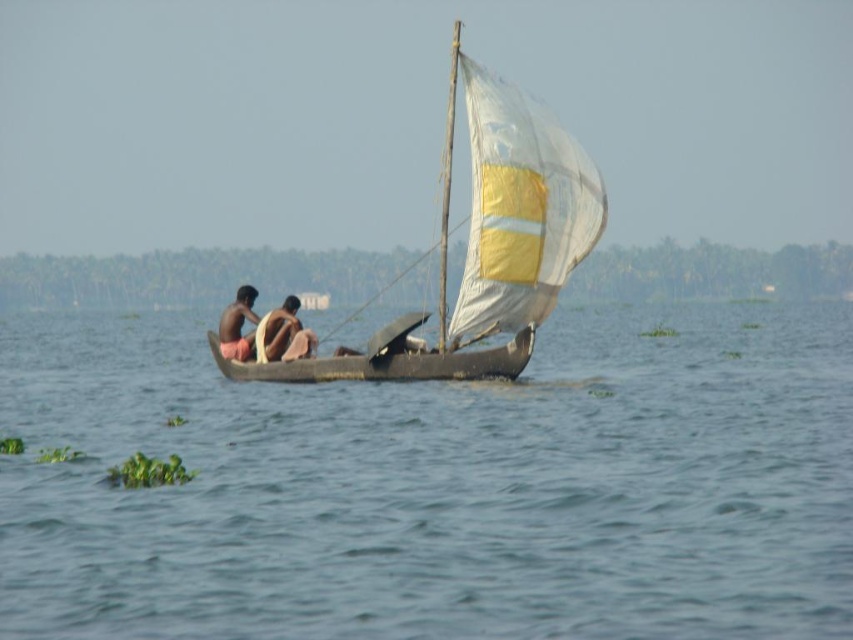
Question: Can you confirm if blue water at center is wider than white fabric sailboat at center?

Choices:
 (A) no
 (B) yes

Answer: (B)

Question: Is brown skin person at center further to the viewer compared to brown skin person at left?

Choices:
 (A) yes
 (B) no

Answer: (B)

Question: Which object appears farthest from the camera in this image?

Choices:
 (A) white fabric sailboat at center
 (B) brown skin person at left
 (C) blue water at center

Answer: (B)

Question: Which object is the farthest from the white fabric sailboat at center?

Choices:
 (A) brown skin person at center
 (B) blue water at center

Answer: (B)

Question: Does blue water at center have a greater width compared to brown skin person at center?

Choices:
 (A) no
 (B) yes

Answer: (B)

Question: Among these objects, which one is nearest to the camera?

Choices:
 (A) brown skin person at left
 (B) blue water at center
 (C) white fabric sailboat at center

Answer: (B)